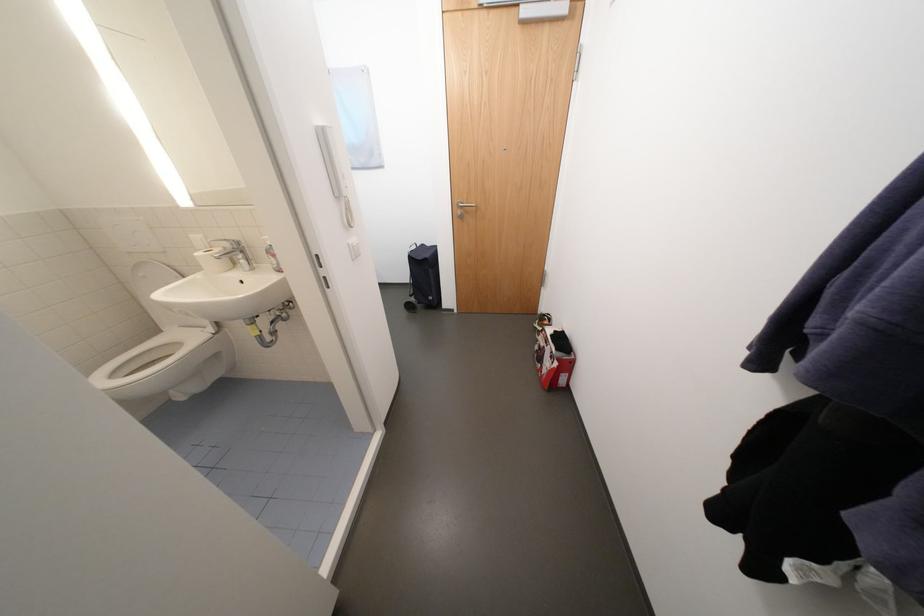
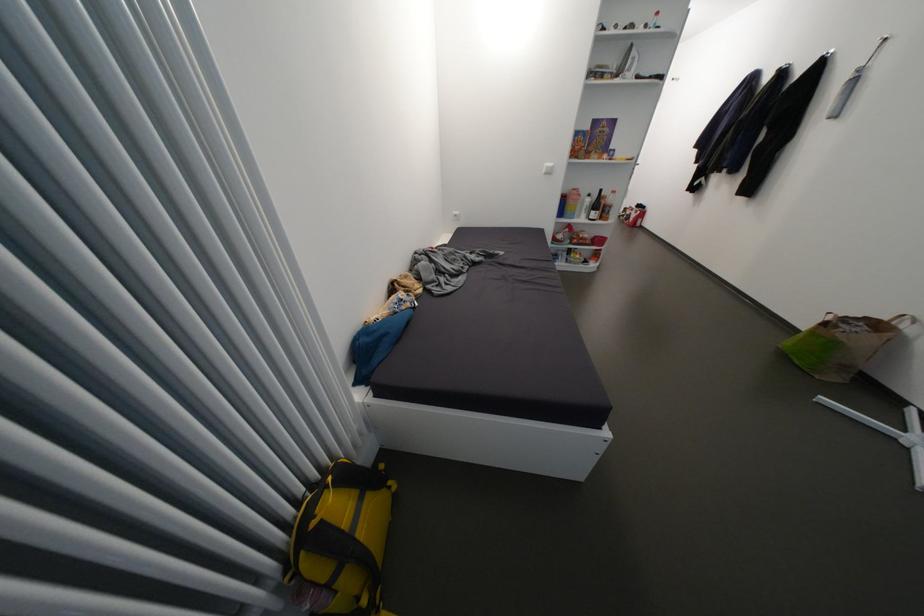
Which direction would the cameraman need to move to produce the second image?

The cameraman walked toward left, backward.